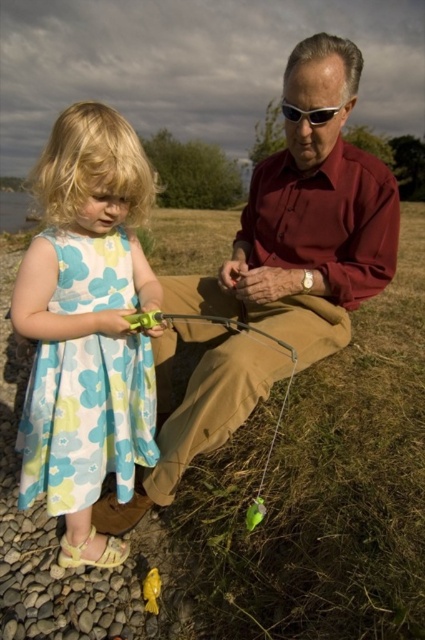
Consider the image. Is matte brown trousers at center wider than floral-patterned fabric dress at left?

Yes.

Is matte brown trousers at center smaller than floral-patterned fabric dress at left?

Actually, matte brown trousers at center might be larger than floral-patterned fabric dress at left.

Is point (108, 515) farther from viewer compared to point (129, 381)?

That is True.

Where is `matte brown trousers at center`? This screenshot has height=640, width=425. matte brown trousers at center is located at coordinates (306, 220).